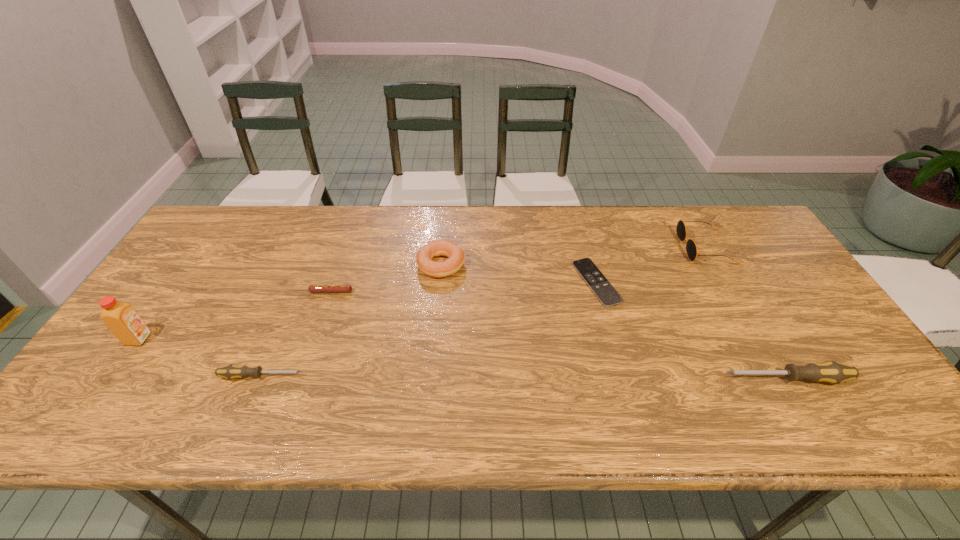
You are a GUI agent. You are given a task and a screenshot of the screen. Output one action in this format:
    pyautogui.click(x=<x>, y=<y>)
    Task: Click on the vacant space at the right edge of the desktop
    
    Given the screenshot: What is the action you would take?
    pyautogui.click(x=772, y=272)

Where is `free space at the far left corner of the desktop`? Image resolution: width=960 pixels, height=540 pixels. free space at the far left corner of the desktop is located at coordinates (215, 247).

You are a GUI agent. You are given a task and a screenshot of the screen. Output one action in this format:
    pyautogui.click(x=<x>, y=<y>)
    Task: Click on the free region at the near left corner of the desktop
    The width and height of the screenshot is (960, 540).
    Given the screenshot: What is the action you would take?
    pyautogui.click(x=98, y=392)

You are a GUI agent. You are given a task and a screenshot of the screen. Output one action in this format:
    pyautogui.click(x=<x>, y=<y>)
    Task: Click on the vacant area at the far right corner
    The height and width of the screenshot is (540, 960).
    Given the screenshot: What is the action you would take?
    pyautogui.click(x=738, y=221)

You are a GUI agent. You are given a task and a screenshot of the screen. Output one action in this format:
    pyautogui.click(x=<x>, y=<y>)
    Task: Click on the vacant space that is in between the shortest object and the fifth tallest object
    The height and width of the screenshot is (540, 960).
    Given the screenshot: What is the action you would take?
    pyautogui.click(x=429, y=329)

This screenshot has width=960, height=540. I want to click on unoccupied position between the remote control and the fourth object from left to right, so click(518, 274).

At what (x,y) coordinates should I click in order to perform the action: click on empty space between the sunglasses and the taller screwdriver. Please return your answer as a coordinate pair (x, y). This screenshot has height=540, width=960. Looking at the image, I should click on (745, 313).

You are a GUI agent. You are given a task and a screenshot of the screen. Output one action in this format:
    pyautogui.click(x=<x>, y=<y>)
    Task: Click on the vacant area that lies between the fourth object from right to left and the sunglasses
    
    Given the screenshot: What is the action you would take?
    pyautogui.click(x=573, y=256)

This screenshot has width=960, height=540. I want to click on blank region between the sunglasses and the shorter screwdriver, so click(x=483, y=312).

Find the location of a particular element. The width and height of the screenshot is (960, 540). free spot between the remote control and the right screwdriver is located at coordinates coord(691,331).